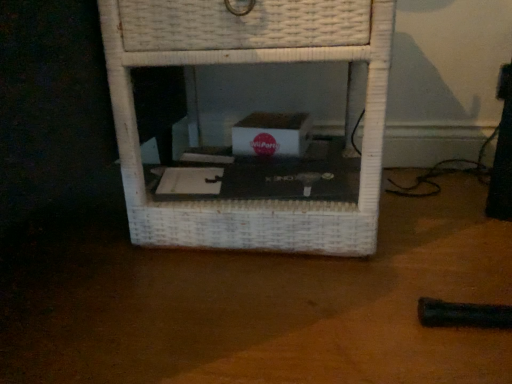
Question: Can you confirm if black matte table at center is bigger than white wicker shelf at center?

Choices:
 (A) yes
 (B) no

Answer: (B)

Question: From the image's perspective, is black matte table at center on white wicker shelf at center?

Choices:
 (A) yes
 (B) no

Answer: (B)

Question: Is black matte table at center to the right of white wicker shelf at center from the viewer's perspective?

Choices:
 (A) yes
 (B) no

Answer: (B)

Question: From a real-world perspective, does black matte table at center sit lower than white wicker shelf at center?

Choices:
 (A) no
 (B) yes

Answer: (B)

Question: Are black matte table at center and white wicker shelf at center making contact?

Choices:
 (A) no
 (B) yes

Answer: (A)

Question: Is the depth of black matte table at center greater than that of white wicker shelf at center?

Choices:
 (A) no
 (B) yes

Answer: (A)

Question: Is black matte table at center a part of white wicker shelf at center?

Choices:
 (A) no
 (B) yes

Answer: (A)

Question: From a real-world perspective, is white wicker shelf at center under black matte table at center?

Choices:
 (A) yes
 (B) no

Answer: (B)

Question: Does white wicker shelf at center turn towards black matte table at center?

Choices:
 (A) yes
 (B) no

Answer: (B)

Question: Can you confirm if white wicker shelf at center is smaller than black matte table at center?

Choices:
 (A) no
 (B) yes

Answer: (A)

Question: Does white wicker shelf at center have a larger size compared to black matte table at center?

Choices:
 (A) no
 (B) yes

Answer: (B)

Question: Does white wicker shelf at center come in front of black matte table at center?

Choices:
 (A) yes
 (B) no

Answer: (B)

Question: Is point (225, 329) positioned closer to the camera than point (329, 246)?

Choices:
 (A) farther
 (B) closer

Answer: (B)